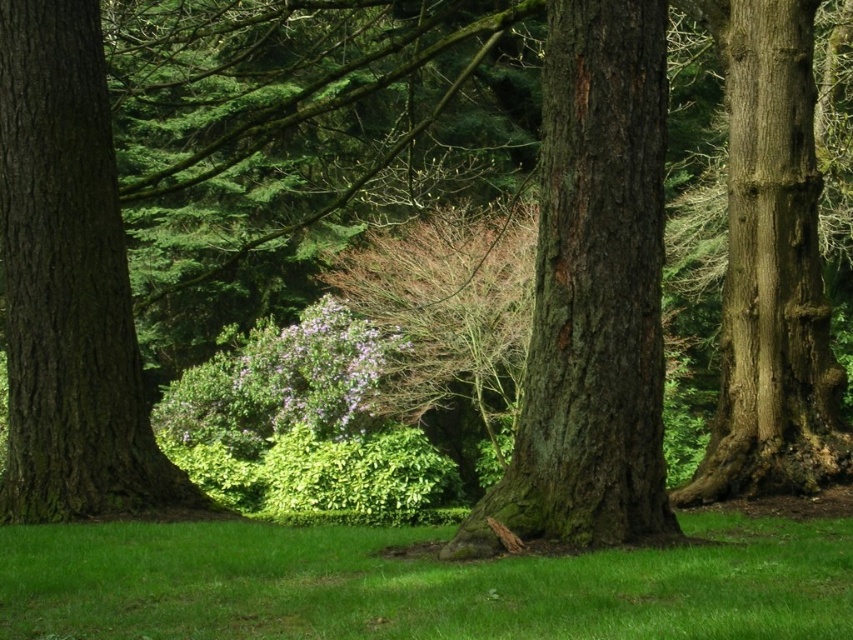
You are a hiker trying to identify the thinnest tree trunk in the forest. You see the green rough bark tree trunk at center and the smooth brown tree trunk at center. Which one should you choose?

The green rough bark tree trunk at center is thinner than smooth brown tree trunk at center, so you should choose the green rough bark tree trunk at center.

You are a gardener who needs to place a 6.5 feet long wooden bench between the green grassy at center and the green rough bark tree trunk at center. Can you fit the bench between them without it overlapping either object?

The distance between the green grassy at center and the green rough bark tree trunk at center is 8.09 feet. Since the bench is 6.5 feet long, it can fit between them as the space is wider than the bench.

You are standing in the forest scene and want to place a small garden gnome exactly between the green grassy at center and the green rough bark tree trunk at center. Which object will the gnome be closer to?

The green grassy at center is smaller than the green rough bark tree trunk at center, so the gnome will be closer to the green grassy at center.